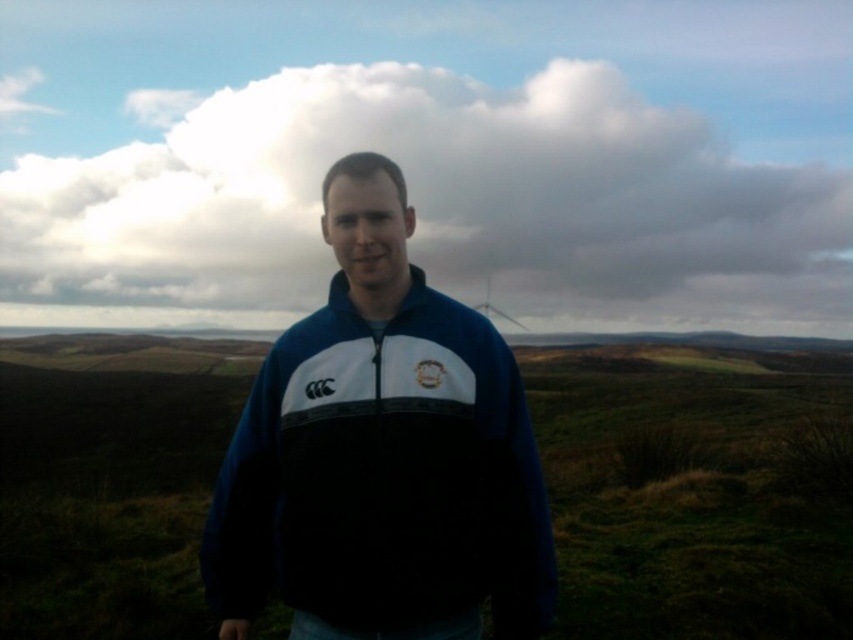
Between white fluffy cloud at upper center and white plastic wind turbine at upper center, which one appears on the left side from the viewer's perspective?

white fluffy cloud at upper center

Does white fluffy cloud at upper center have a lesser height compared to white plastic wind turbine at upper center?

Incorrect, white fluffy cloud at upper center's height does not fall short of white plastic wind turbine at upper center's.

The image size is (853, 640). Describe the element at coordinates (434, 208) in the screenshot. I see `white fluffy cloud at upper center` at that location.

Locate an element on the screen. white fluffy cloud at upper center is located at coordinates (434, 208).

Is point (154, 508) positioned before point (508, 317)?

Yes.

The image size is (853, 640). Describe the element at coordinates (695, 488) in the screenshot. I see `green grassy at center` at that location.

This screenshot has height=640, width=853. Describe the element at coordinates (695, 488) in the screenshot. I see `green grassy at center` at that location.

Image resolution: width=853 pixels, height=640 pixels. What are the coordinates of `green grassy at center` in the screenshot? It's located at (695, 488).

Does white fluffy cloud at upper center appear over blue fleece jacket at center?

Yes.

Between white fluffy cloud at upper center and blue fleece jacket at center, which one has more height?

white fluffy cloud at upper center

The image size is (853, 640). What are the coordinates of `white fluffy cloud at upper center` in the screenshot? It's located at (434, 208).